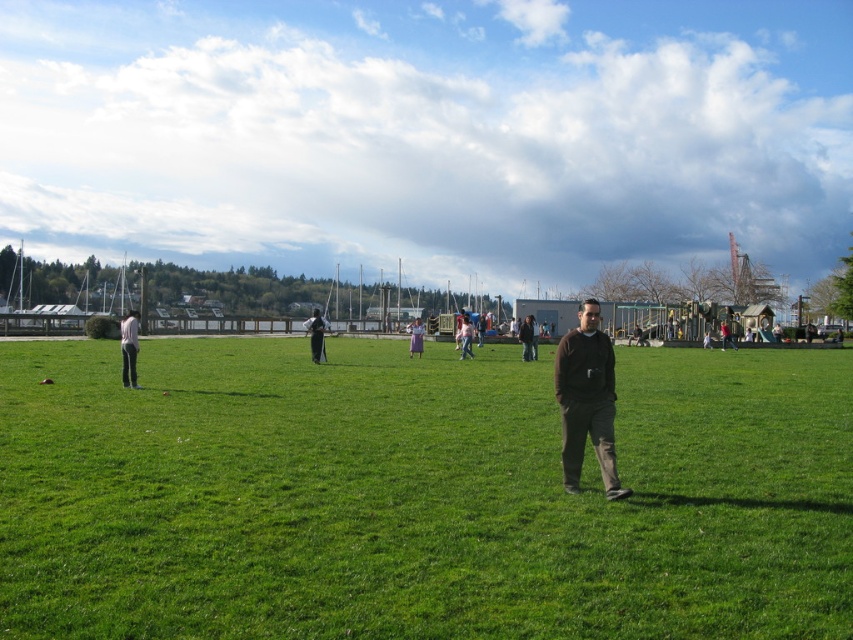
Does pink fabric dress at center come behind brown leather jacket at center?

No, it is in front of brown leather jacket at center.

In the scene shown: Who is more forward, (462, 332) or (723, 323)?

Point (462, 332) is more forward.

Does point (466, 339) lie behind point (728, 342)?

No.

At what (x,y) coordinates should I click in order to perform the action: click on pink fabric dress at center. Please return your answer as a coordinate pair (x, y). The width and height of the screenshot is (853, 640). Looking at the image, I should click on (465, 337).

Which is more to the left, light pink fabric pants at left or brown leather jacket at center?

light pink fabric pants at left is more to the left.

Does light pink fabric pants at left appear over brown leather jacket at center?

Correct, light pink fabric pants at left is located above brown leather jacket at center.

Who is more distant from viewer, (x=126, y=356) or (x=724, y=348)?

Point (x=724, y=348)

Find the location of a particular element. light pink fabric pants at left is located at coordinates (129, 348).

Can you confirm if green grass at center is positioned to the right of black fabric pants at center?

Yes, green grass at center is to the right of black fabric pants at center.

Is green grass at center closer to camera compared to black fabric pants at center?

Yes, it is in front of black fabric pants at center.

Which is in front, point (234, 566) or point (311, 348)?

Point (234, 566)

The image size is (853, 640). I want to click on green grass at center, so pos(418,493).